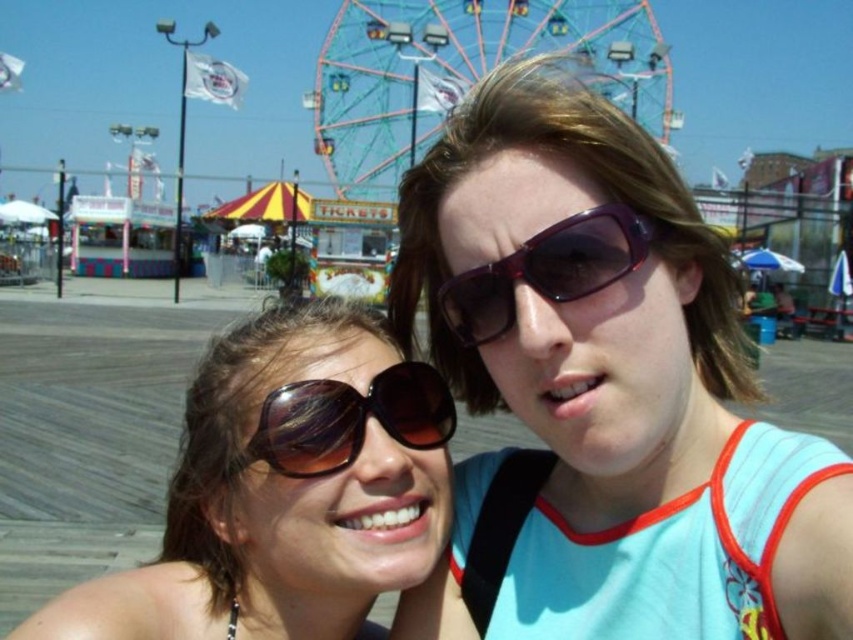
Question: Does metallic blue ferris wheel at upper center have a greater width compared to matte brown sunglasses at center?

Choices:
 (A) yes
 (B) no

Answer: (A)

Question: Among these points, which one is farthest from the camera?

Choices:
 (A) (456, 44)
 (B) (165, 518)
 (C) (646, 221)
 (D) (440, 400)

Answer: (A)

Question: Does brown matte sunglasses at center have a lesser width compared to shiny brown sunglasses at center?

Choices:
 (A) no
 (B) yes

Answer: (A)

Question: Which object is closer to the camera taking this photo?

Choices:
 (A) brown matte sunglasses at center
 (B) matte brown sunglasses at center

Answer: (A)

Question: Which point is closer to the camera taking this photo?

Choices:
 (A) (659, 236)
 (B) (343, 99)
 (C) (310, 388)
 (D) (238, 500)

Answer: (A)

Question: From the image, what is the correct spatial relationship of metallic blue ferris wheel at upper center in relation to shiny brown sunglasses at center?

Choices:
 (A) below
 (B) above

Answer: (B)